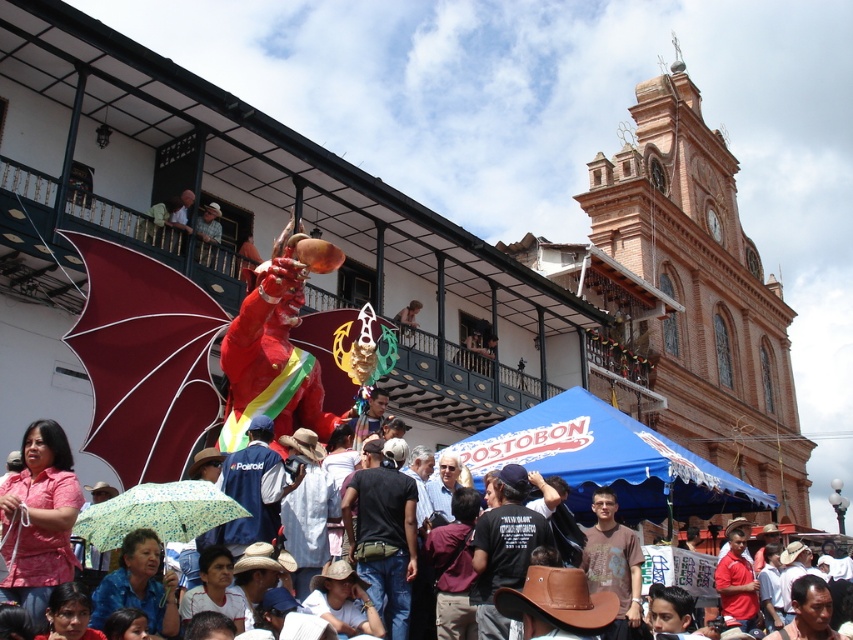
Question: In this image, where is pink fabric at center located relative to light blue fabric umbrella at lower center?

Choices:
 (A) below
 (B) above

Answer: (A)

Question: Which of the following is the closest to the observer?

Choices:
 (A) (666, 480)
 (B) (115, 371)
 (C) (26, 608)
 (D) (184, 538)

Answer: (C)

Question: Which point is closer to the camera?

Choices:
 (A) (634, 477)
 (B) (170, 416)

Answer: (B)

Question: Can you confirm if matte black cowboy hat at center is bigger than pink fabric at center?

Choices:
 (A) yes
 (B) no

Answer: (A)

Question: Which is nearer to the light blue fabric umbrella at lower center?

Choices:
 (A) pink fabric at center
 (B) burgundy fabric umbrella at left

Answer: (A)

Question: From the image, what is the correct spatial relationship of pink fabric at center in relation to light blue fabric umbrella at lower center?

Choices:
 (A) above
 (B) below

Answer: (B)